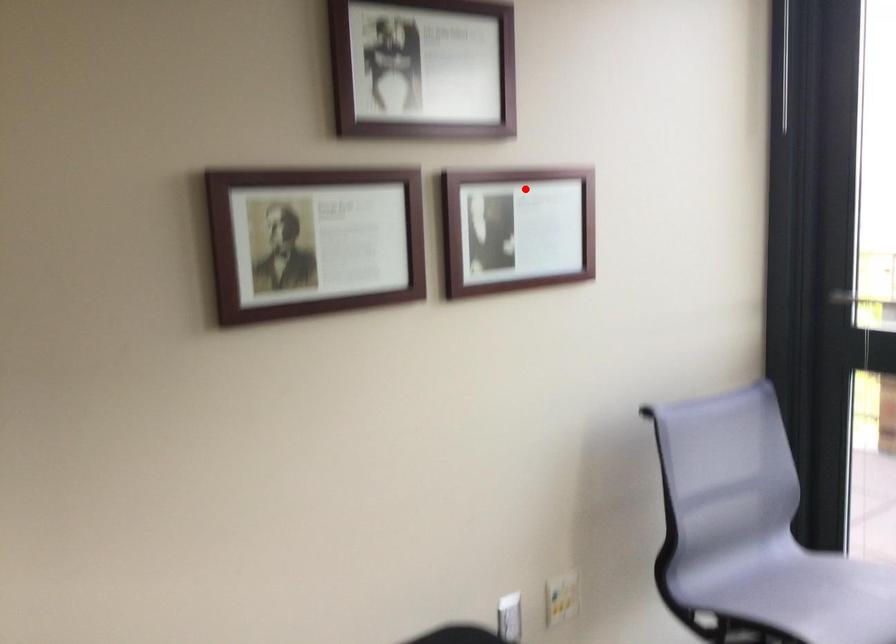
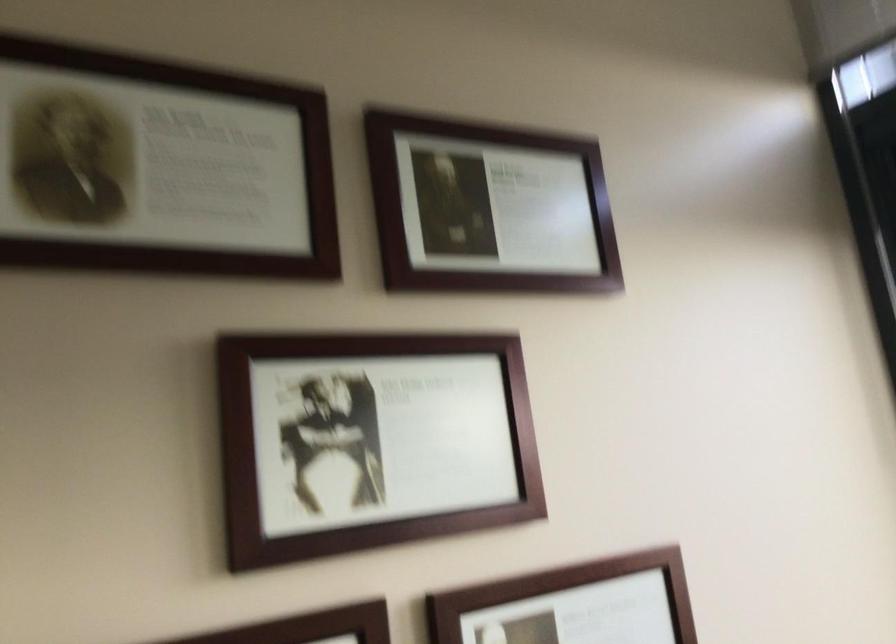
In the second image, find the point that corresponds to the highlighted location in the first image.

(573, 605)